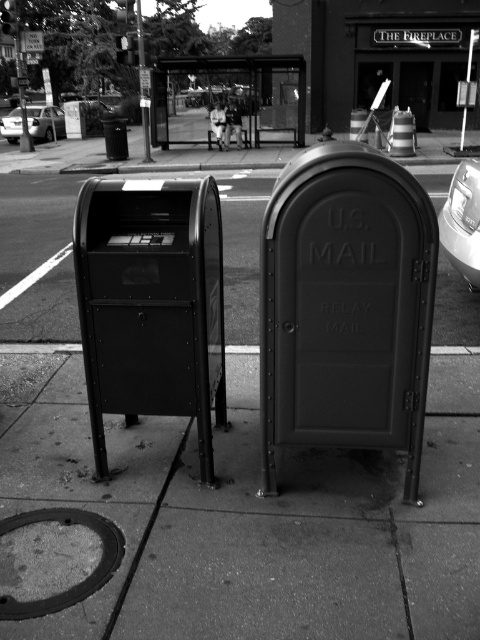
Question: Is smooth concrete sidewalk at center positioned in front of matte black mailbox at left?

Choices:
 (A) no
 (B) yes

Answer: (B)

Question: Among these points, which one is farthest from the camera?

Choices:
 (A) click(211, 113)
 (B) click(12, 140)

Answer: (B)

Question: Which of these objects is positioned farthest from the matte black mailbox at center?

Choices:
 (A) smooth concrete sidewalk at center
 (B) metallic silver car at right
 (C) white fabric couple at center
 (D) metallic silver sedan at left

Answer: (D)

Question: Does smooth concrete sidewalk at center appear under metallic silver car at right?

Choices:
 (A) no
 (B) yes

Answer: (B)

Question: In this image, where is smooth concrete sidewalk at center located relative to matte black mailbox at center?

Choices:
 (A) below
 (B) above

Answer: (A)

Question: Which object appears closest to the camera in this image?

Choices:
 (A) matte black mailbox at center
 (B) metallic silver car at right

Answer: (A)